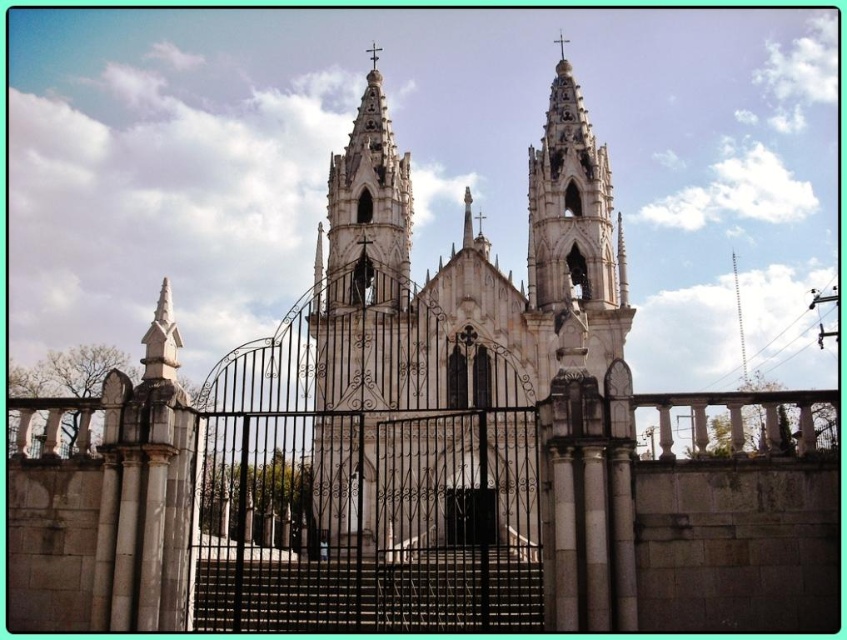
You are a visitor approaching the white stone church at center and the black matte door at center. Which structure will you encounter first as you walk towards the church?

The white stone church at center is closer to the viewer than the black matte door at center, so you will encounter the white stone church at center first.

You are standing in front of the grand Gothic church and want to take a photo of the point at coordinates point [436,460]. If your camera has a maximum focusing distance of 100 meters, will you be able to focus on that point?

The point [436,460] is 102.02 meters from the camera, which exceeds the maximum focusing distance of 100 meters. Therefore, the camera cannot focus on that point.